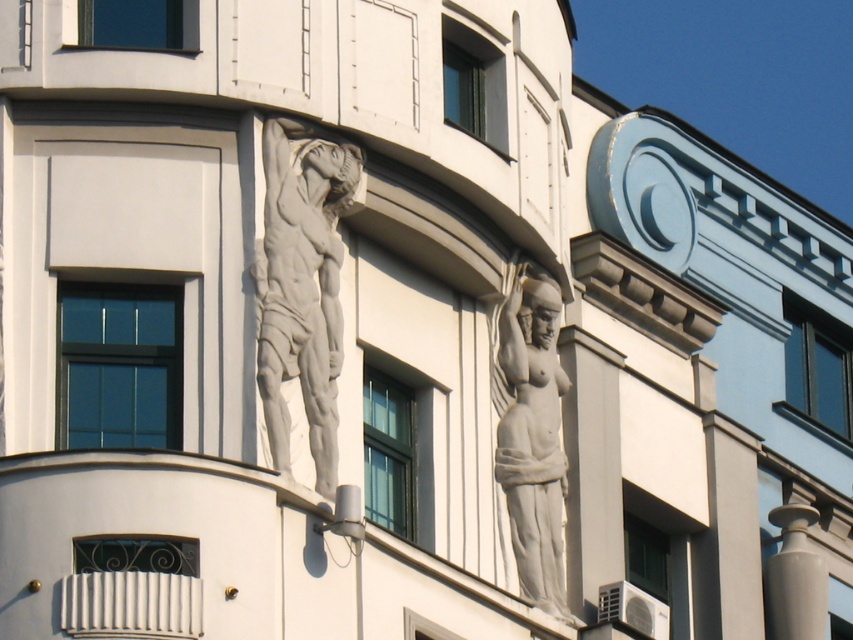
You are an architect reviewing the building facade. You need to place a new decorative element between the white stone sculpture at upper center and the building wall. Can you determine if there is enough space for it?

The white stone sculpture at upper center is located at point (302, 285), so there is sufficient space between it and the building wall to place the new decorative element.

You are an architect analyzing the building facade. You notice two points marked on the facade at coordinates point (x=262, y=252) and point (x=527, y=344). Based on the spatial relationship between these points, which point is closer to the viewer?

Point (x=262, y=252) is in front of point (x=527, y=344), so it is closer to the viewer.

Looking at this image, you are an architect designing a new building and want to ensure that the white marble statue at center and the white glossy pillar at lower right are proportionate. Based on the scene, which object is shorter?

The white marble statue at center is not as tall as the white glossy pillar at lower right, so the statue is shorter than the pillar.